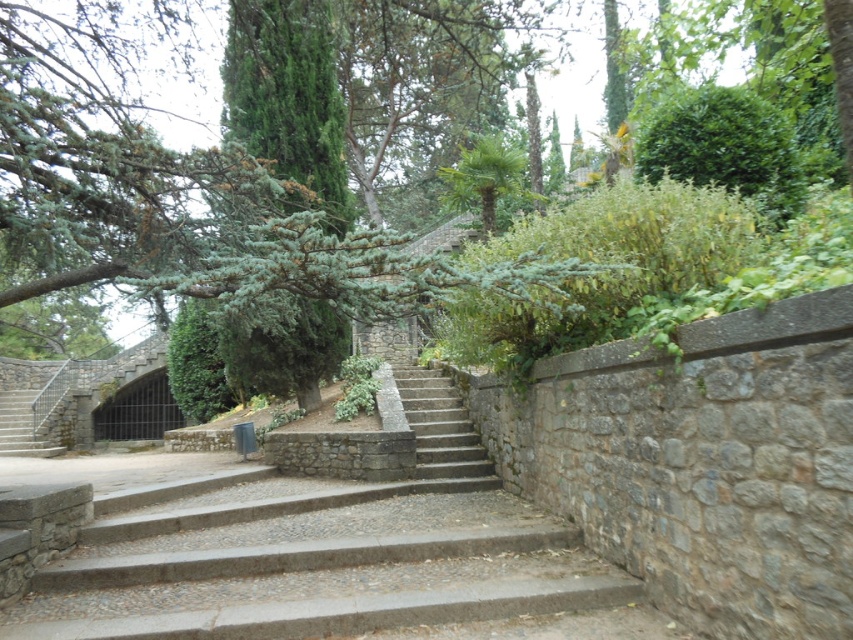
Question: Which point is farther from the camera taking this photo?

Choices:
 (A) 412,371
 (B) 514,509

Answer: (A)

Question: Does gray stone stairs at center lie behind stone steps at center?

Choices:
 (A) no
 (B) yes

Answer: (A)

Question: Can you confirm if gray stone stairs at center is wider than stone steps at center?

Choices:
 (A) no
 (B) yes

Answer: (B)

Question: Does gray stone stairs at center have a greater width compared to stone steps at center?

Choices:
 (A) yes
 (B) no

Answer: (A)